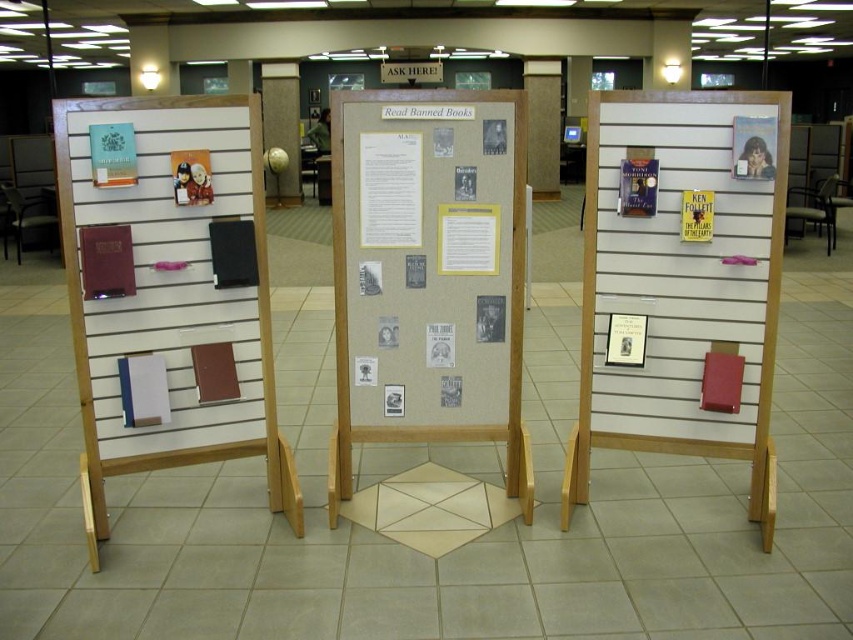
Based on the photo, what is located at the coordinates point (425, 276) in the image?

The point (425, 276) is on the beige fabric poster at center.

You are a visitor in the library and want to hang a new poster between the beige fabric poster at center and the matte plastic poster at center. Which poster should you place your new poster next to if you want it to be closer to the larger poster?

The beige fabric poster at center is bigger than the matte plastic poster at center, so placing the new poster next to the beige fabric poster at center would make it closer to the larger poster.